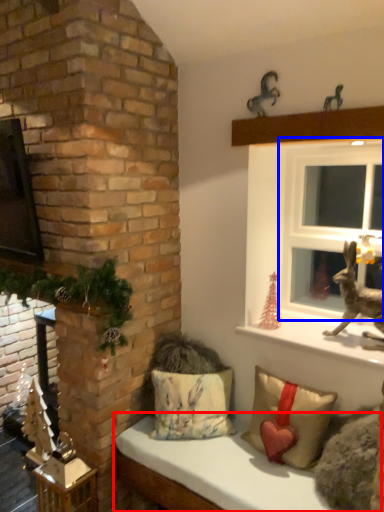
Question: Which object is further to the camera taking this photo, furniture (highlighted by a red box) or window (highlighted by a blue box)?

Choices:
 (A) furniture
 (B) window

Answer: (B)